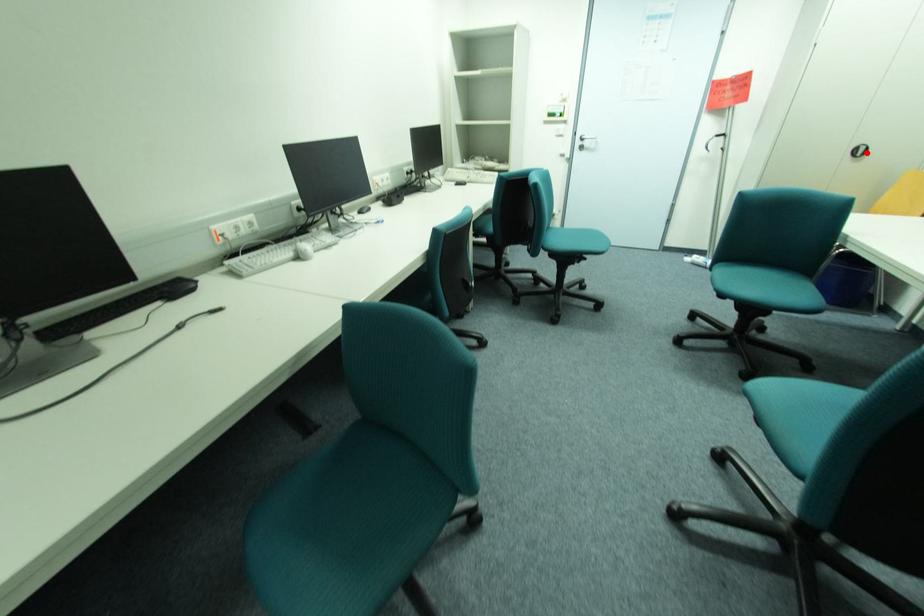
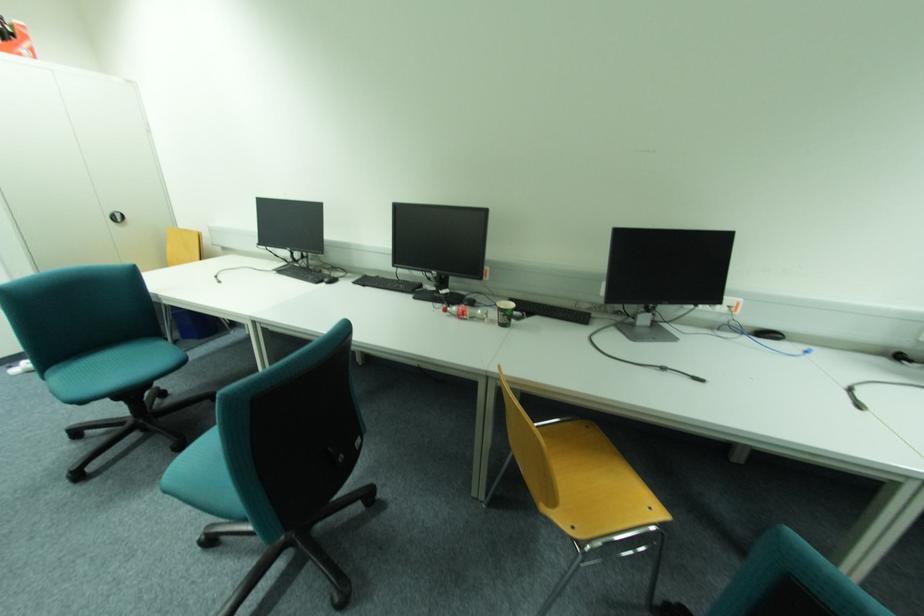
Question: I am providing you with two images of the same scene from different viewpoints. In image1, a red point is highlighted. Considering the same 3D point in image2, which of the following is correct?

Choices:
 (A) It is closer
 (B) It is farther

Answer: (A)